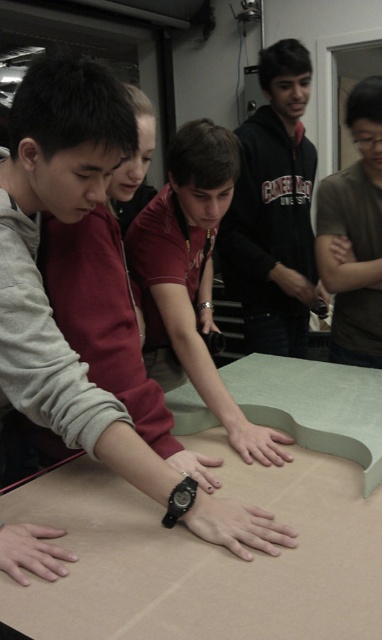
Question: Does matte red shirt at center have a lesser width compared to black rubber watch at center?

Choices:
 (A) no
 (B) yes

Answer: (A)

Question: In this image, where is dark gray hoodie at center located relative to smooth beige hand at lower left?

Choices:
 (A) left
 (B) right

Answer: (B)

Question: Does skinny white hand at center have a greater width compared to black rubber watch at center?

Choices:
 (A) no
 (B) yes

Answer: (B)

Question: Which point is closer to the camera?

Choices:
 (A) (260, 140)
 (B) (29, 548)
 (C) (0, 604)

Answer: (C)

Question: Which of the following is the farthest from the observer?

Choices:
 (A) matte red shirt at center
 (B) black rubber watch at center
 (C) matte gray hand at center
 (D) brown cardboard table at center

Answer: (A)

Question: Which of these objects is positioned closest to the smooth beige hand at lower left?

Choices:
 (A) skinny white hand at center
 (B) dark gray hoodie at center

Answer: (A)